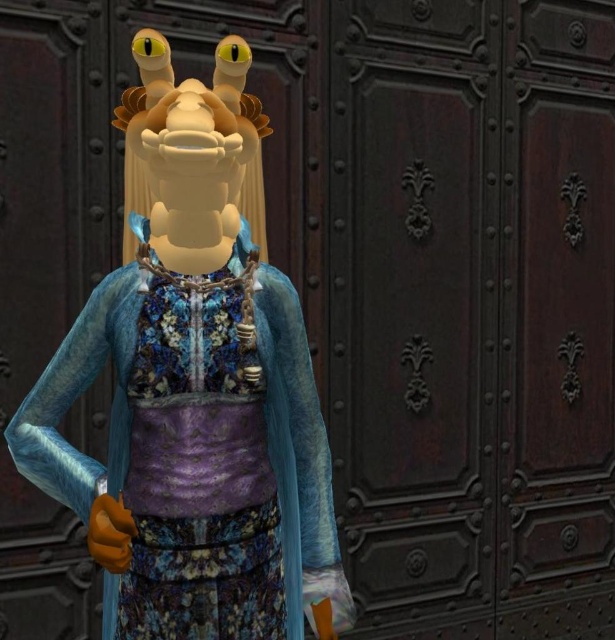
Question: Does matte blue fabric doll at center appear under velvet purple dress at center?

Choices:
 (A) yes
 (B) no

Answer: (B)

Question: Does matte blue fabric doll at center appear over velvet purple dress at center?

Choices:
 (A) yes
 (B) no

Answer: (A)

Question: Does matte blue fabric doll at center have a smaller size compared to velvet purple dress at center?

Choices:
 (A) yes
 (B) no

Answer: (B)

Question: Which of the following is the farthest from the observer?

Choices:
 (A) velvet purple dress at center
 (B) matte blue fabric doll at center

Answer: (A)